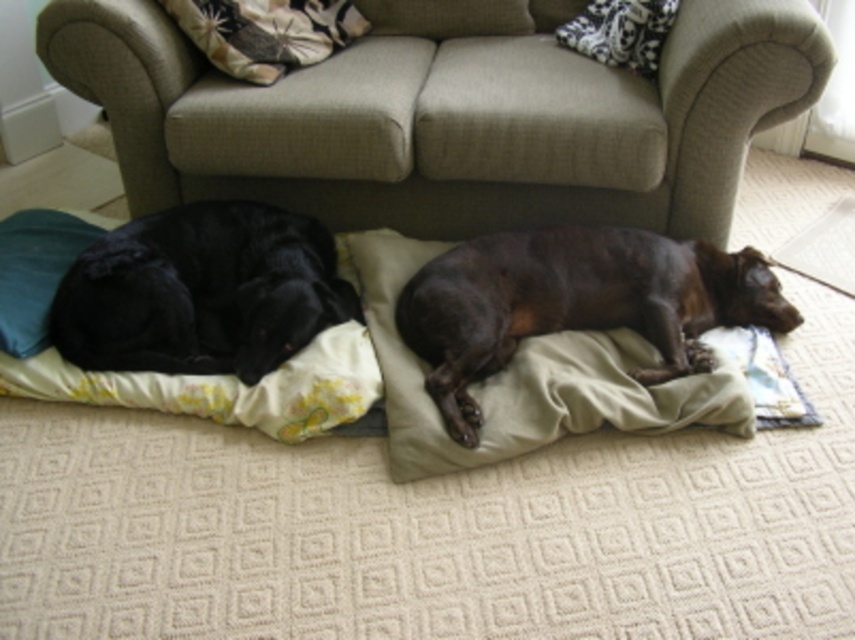
You are a pet sitter who needs to ensure all pets are comfortable. You see the brown fuzzy dog at lower right and the patterned fabric pillow at upper center. Which object takes up more space in the scene?

The brown fuzzy dog at lower right is bigger than the patterned fabric pillow at upper center, so it takes up more space in the scene.

You are a dog owner who wants to place a new fluffy fabric pillow at upper center in the room where the shiny black dog at left is resting. Considering the dog is much taller than the pillow, will the pillow be visible to the dog?

The shiny black dog at left is much taller than the fluffy fabric pillow at upper center, so the pillow might be partially or fully hidden from the dog if placed at the same level. Adjust the pillow height or position to ensure visibility.